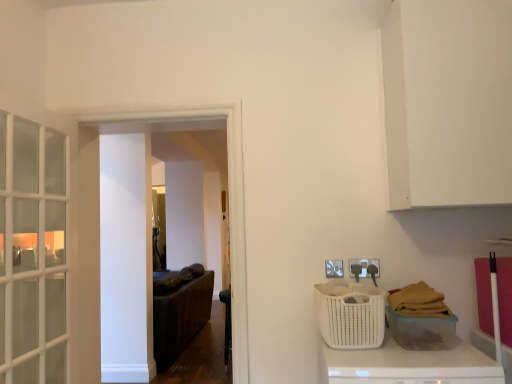
I want to click on free space in front of white woven basket at lower right, which is the first basket in left-to-right order, so click(x=384, y=362).